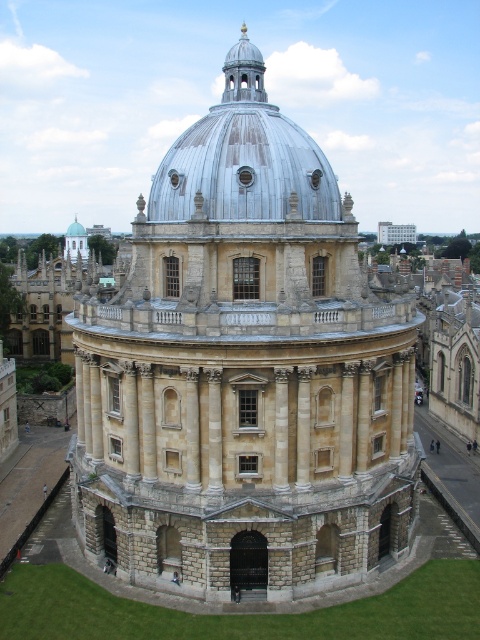
Which is above, beige stone dome at center or metallic silver dome at center?

Positioned higher is metallic silver dome at center.

The height and width of the screenshot is (640, 480). Describe the element at coordinates (244, 372) in the screenshot. I see `beige stone dome at center` at that location.

Who is more forward, (273, 224) or (288, 205)?

Point (273, 224) is more forward.

This screenshot has height=640, width=480. In order to click on beige stone dome at center in this screenshot , I will do `click(244, 372)`.